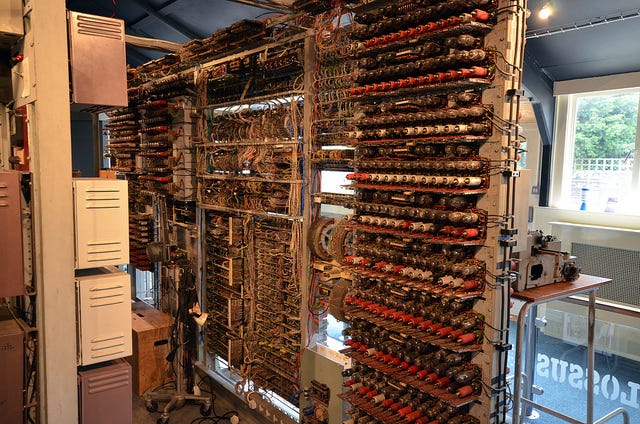
Where is `vent`? vent is located at coordinates (624, 275).